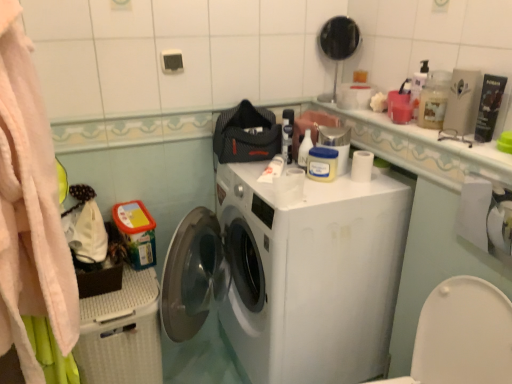
Question: From the image's perspective, would you say matte black mirror at upper center is positioned over white glossy countertop at upper right?

Choices:
 (A) no
 (B) yes

Answer: (B)

Question: Considering the relative sizes of matte black mirror at upper center and white glossy countertop at upper right in the image provided, is matte black mirror at upper center wider than white glossy countertop at upper right?

Choices:
 (A) yes
 (B) no

Answer: (A)

Question: From a real-world perspective, is matte black mirror at upper center under white glossy countertop at upper right?

Choices:
 (A) yes
 (B) no

Answer: (B)

Question: Considering the relative sizes of matte black mirror at upper center and white glossy countertop at upper right in the image provided, is matte black mirror at upper center taller than white glossy countertop at upper right?

Choices:
 (A) no
 (B) yes

Answer: (B)

Question: From a real-world perspective, is matte black mirror at upper center on white glossy countertop at upper right?

Choices:
 (A) yes
 (B) no

Answer: (A)

Question: In the image, is translucent plastic bottle at upper right, the 2th cleaning product when ordered from back to front, on the left side or the right side of matte black mirror at upper center?

Choices:
 (A) left
 (B) right

Answer: (B)

Question: Relative to matte black mirror at upper center, is translucent plastic bottle at upper right, which is the first cleaning product in right-to-left order, in front or behind?

Choices:
 (A) behind
 (B) front

Answer: (B)

Question: Based on their sizes in the image, would you say translucent plastic bottle at upper right, the 2th cleaning product when ordered from back to front, is bigger or smaller than matte black mirror at upper center?

Choices:
 (A) big
 (B) small

Answer: (B)

Question: Does point (423, 99) appear closer or farther from the camera than point (352, 41)?

Choices:
 (A) farther
 (B) closer

Answer: (B)

Question: Looking at the image, does white matte washing machine at center seem bigger or smaller compared to white matte toilet paper at lower right?

Choices:
 (A) big
 (B) small

Answer: (A)

Question: Looking at their shapes, would you say white matte washing machine at center is wider or thinner than white matte toilet paper at lower right?

Choices:
 (A) thin
 (B) wide

Answer: (B)

Question: From a real-world perspective, is white matte washing machine at center above or below white matte toilet paper at lower right?

Choices:
 (A) below
 (B) above

Answer: (A)

Question: From the image's perspective, is white matte washing machine at center above or below white matte toilet paper at lower right?

Choices:
 (A) below
 (B) above

Answer: (A)

Question: Does point (481, 200) appear closer or farther from the camera than point (303, 140)?

Choices:
 (A) closer
 (B) farther

Answer: (B)

Question: From a real-world perspective, relative to white glossy bottle at upper center, which appears as the second cleaning product when viewed from the front, is white matte toilet paper at lower right vertically above or below?

Choices:
 (A) above
 (B) below

Answer: (B)